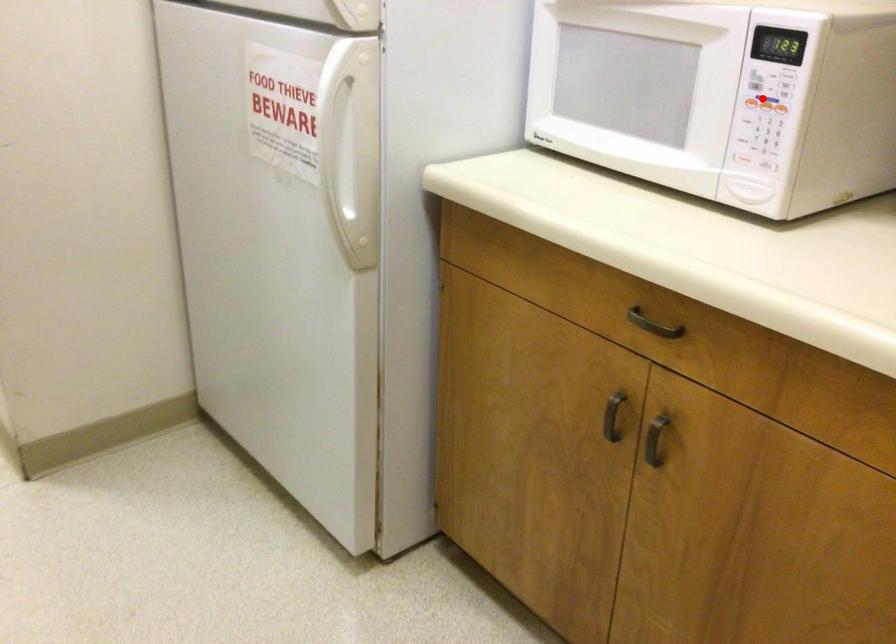
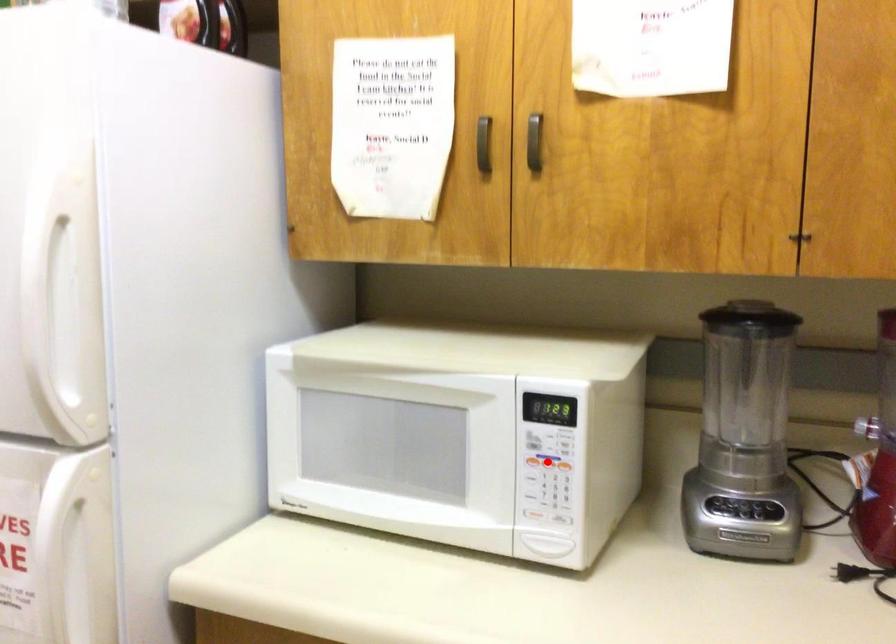
I am providing you with two images of the same scene from different viewpoints. A red point is marked on the first image and another point is marked on the second image. Are the points marked in image1 and image2 representing the same 3D position?

Yes